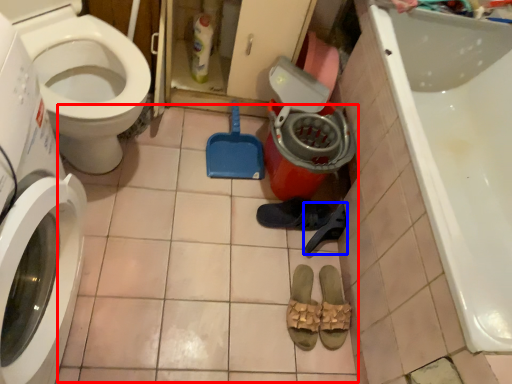
Question: Which object appears farthest to the camera in this image, tile (highlighted by a red box) or shoe (highlighted by a blue box)?

Choices:
 (A) tile
 (B) shoe

Answer: (B)